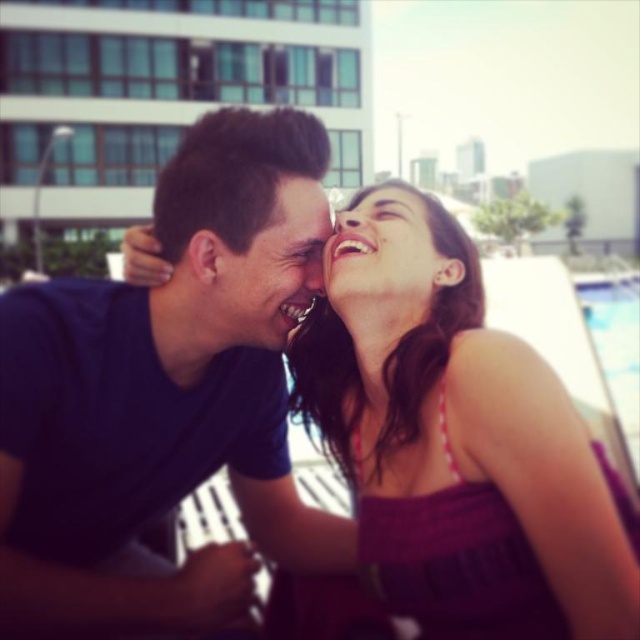
From the picture: You are a photographer trying to capture a closeup of the purple knit dress at center and the matte black forehead at upper center. Which object should you focus on first to ensure it appears sharp in the photo?

The purple knit dress at center is closer to the viewer than the matte black forehead at upper center, so you should focus on the purple knit dress at center first to ensure it appears sharp.

You are a photographer trying to capture the purple knit dress at center in a closeup shot. Based on its position, which part of the image should you focus on to ensure the dress is the main subject?

The purple knit dress at center is located at point (x=456, y=440), so you should focus on the center area slightly towards the right to ensure the dress is the main subject.